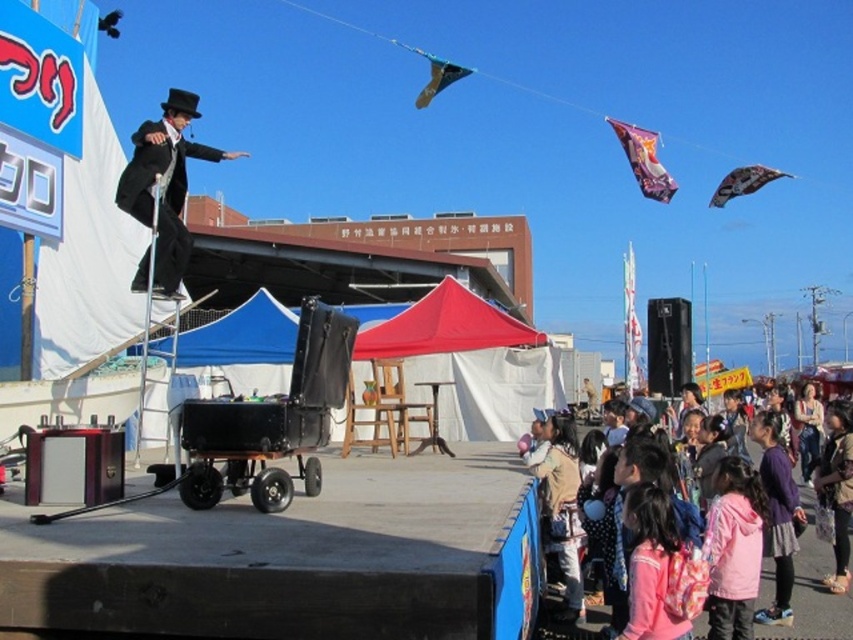
You are standing at the performer on the stage and see two points in the image. Which point is closer to you, point (167, 129) or point (520, 330)?

Point (167, 129) is in front of point (520, 330), so it is closer to the performer on the stage.

You are a photographer at the event and want to capture both the shiny black suit at upper left and the fluffy brown coat at lower right in a single photo. Which subject should you focus on first to ensure both are in frame?

The shiny black suit at upper left is much taller than the fluffy brown coat at lower right, so you should focus on the shiny black suit at upper left first to ensure both are in frame.